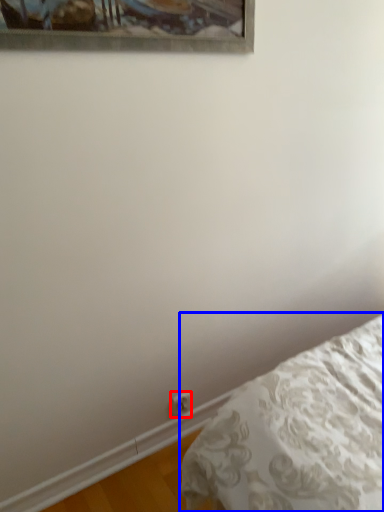
Question: Which point is further to the camera, electric outlet (highlighted by a red box) or bed (highlighted by a blue box)?

Choices:
 (A) electric outlet
 (B) bed

Answer: (A)